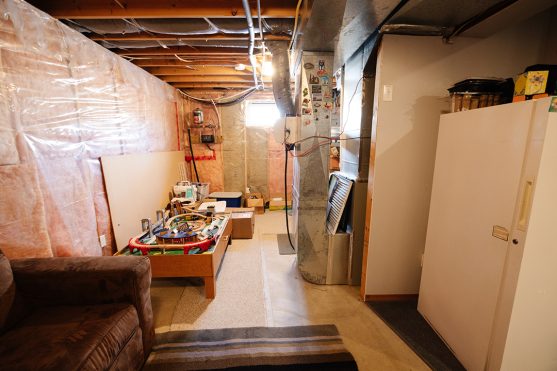
Locate an element on the screen. area rug is located at coordinates (201, 349).